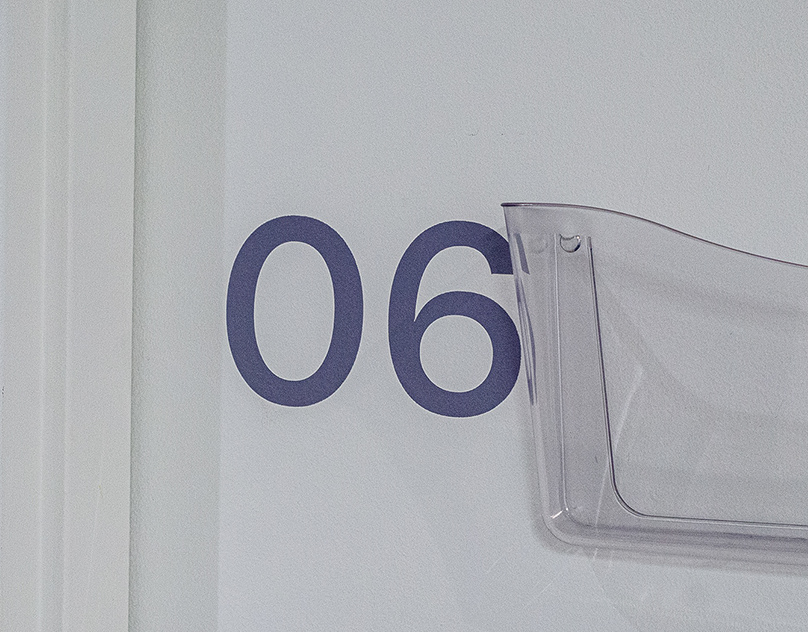
I want to click on tray, so click(x=600, y=459).